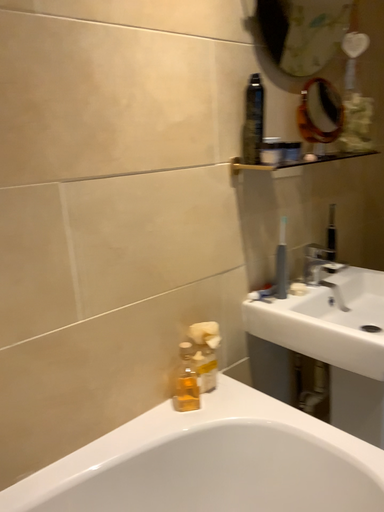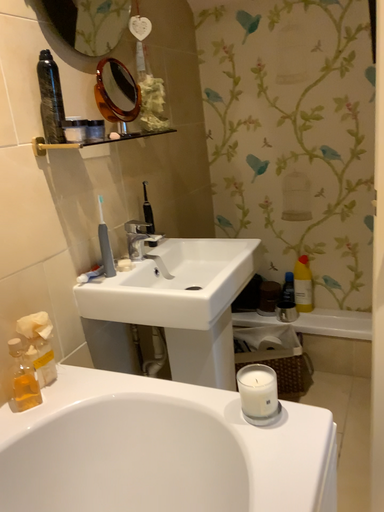
Question: How did the camera likely rotate when shooting the video?

Choices:
 (A) rotated right
 (B) rotated left

Answer: (A)